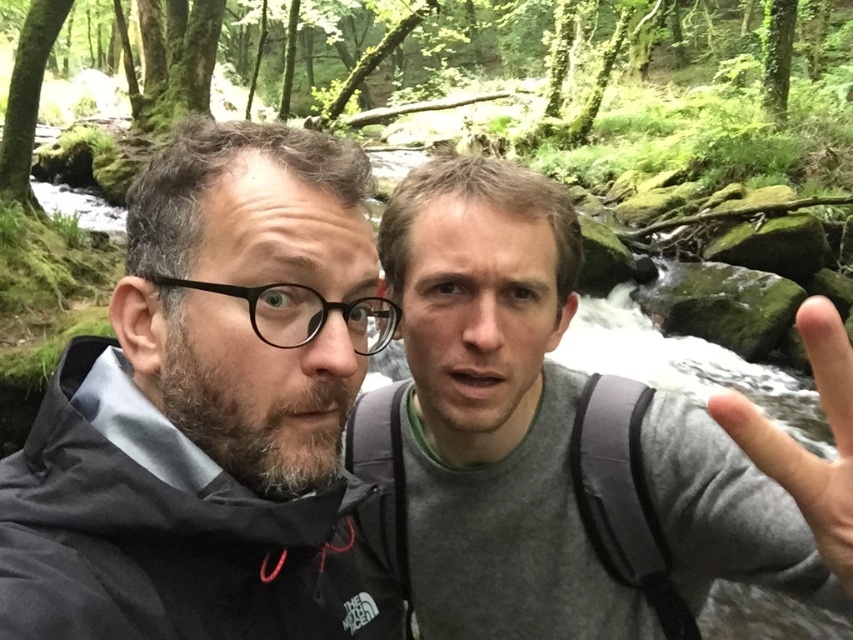
Question: Does gray fabric backpack at center-right appear under skinny flesh at center?

Choices:
 (A) yes
 (B) no

Answer: (B)

Question: Does dark gray jacket at left appear over gray fabric backpack at center-right?

Choices:
 (A) no
 (B) yes

Answer: (A)

Question: Does gray fabric backpack at center-right appear under skinny flesh at center?

Choices:
 (A) no
 (B) yes

Answer: (A)

Question: Which point appears closest to the camera in this image?

Choices:
 (A) (849, 348)
 (B) (439, 360)

Answer: (A)

Question: Which point appears farthest from the camera in this image?

Choices:
 (A) (199, 172)
 (B) (494, 634)
 (C) (828, 403)

Answer: (B)

Question: Which point is farther to the camera?

Choices:
 (A) (840, 403)
 (B) (665, 536)

Answer: (B)